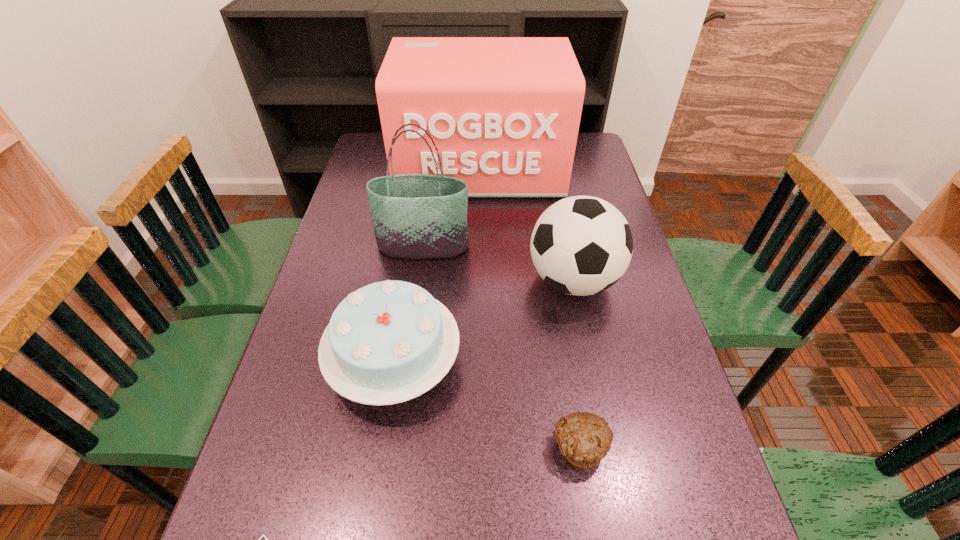
At what (x,y) coordinates should I click in order to perform the action: click on vacant space that satisfies the following two spatial constraints: 1. on the surface of the farthest object where the text is embossed; 2. on the left side of the second shortest object. Please return your answer as a coordinate pair (x, y). Looking at the image, I should click on (481, 447).